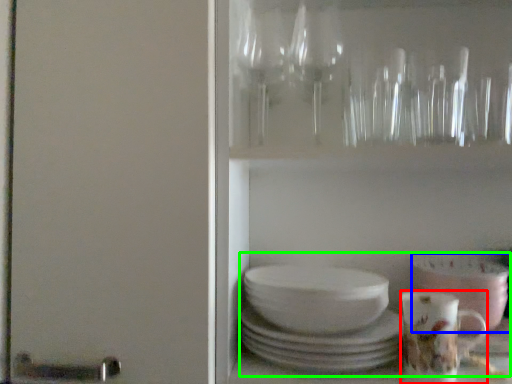
Question: Which is farther away from coffee cup (highlighted by a red box)? bowl (highlighted by a blue box) or tea set (highlighted by a green box)?

Choices:
 (A) bowl
 (B) tea set

Answer: (B)